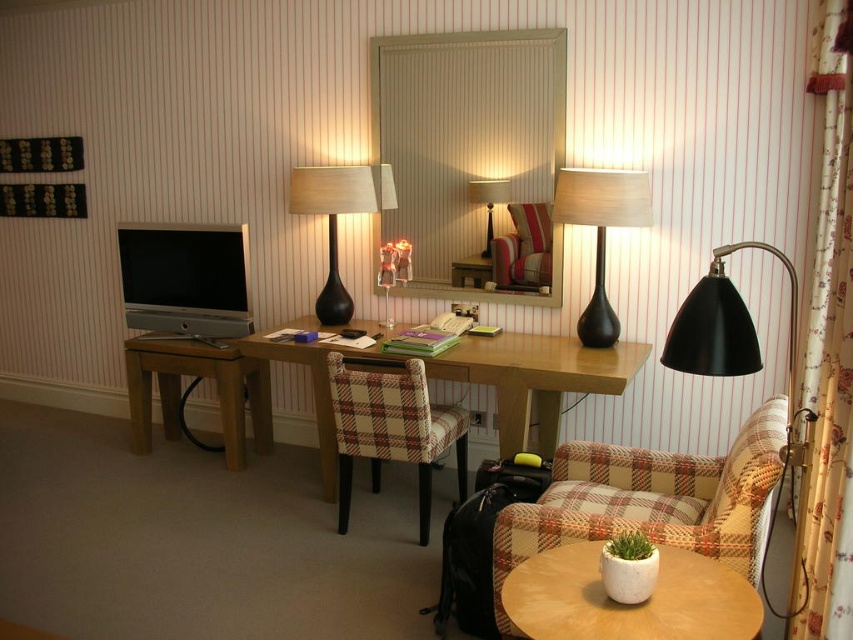
Question: Which of these objects is positioned farthest from the matte black lamp at center?

Choices:
 (A) plaid fabric armchair at lower right
 (B) matte black lamp at right
 (C) black glass table lamp at center
 (D) white ceramic table at lower right

Answer: (D)

Question: Is plaid fabric armchair at lower right above matte black lamp at center?

Choices:
 (A) yes
 (B) no

Answer: (B)

Question: Which of the following is the closest to the observer?

Choices:
 (A) (347, 371)
 (B) (699, 356)

Answer: (B)

Question: Is wooden desk at center further to camera compared to matte black lamp at center?

Choices:
 (A) no
 (B) yes

Answer: (A)

Question: Which point is closer to the camera taking this photo?

Choices:
 (A) (599, 173)
 (B) (485, 253)
 (C) (534, 227)

Answer: (A)

Question: Is floral fabric curtain at right above matte black lamp at right?

Choices:
 (A) no
 (B) yes

Answer: (A)